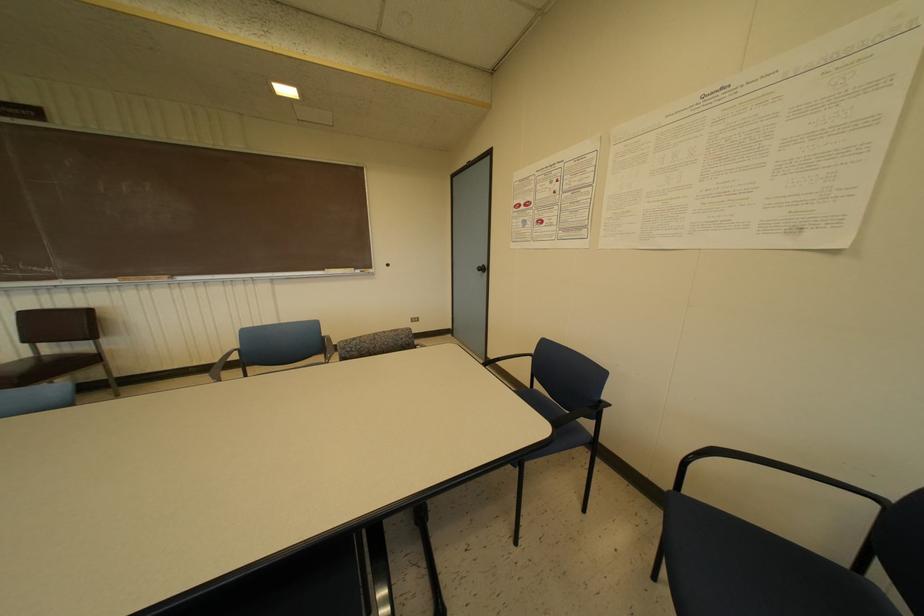
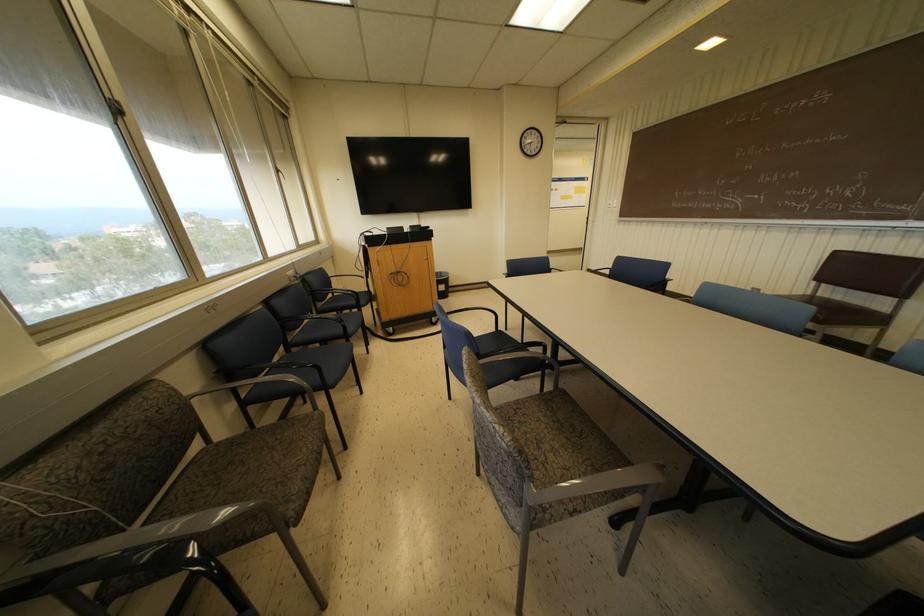
Find the pixel in the second image that matches (x=78, y=294) in the first image.

(914, 240)